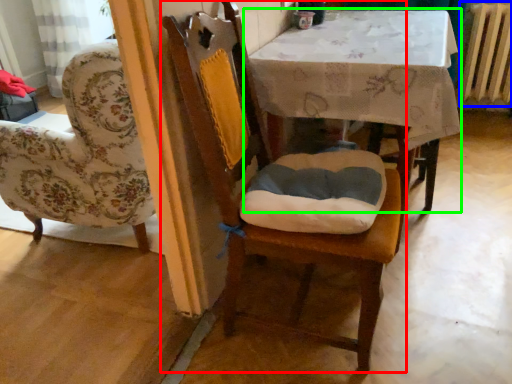
Question: Considering the real-world distances, which object is closest to chair (highlighted by a red box)? radiator (highlighted by a blue box) or table (highlighted by a green box).

Choices:
 (A) radiator
 (B) table

Answer: (B)